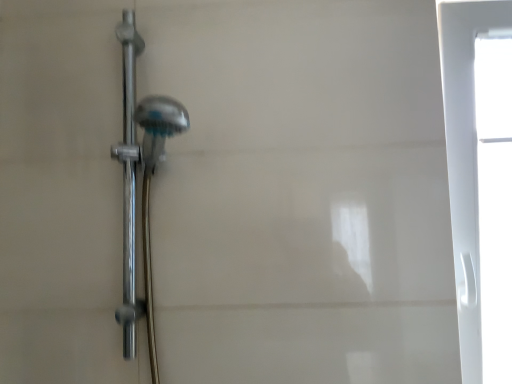
Where is `polished chrome shower head at left`? The height and width of the screenshot is (384, 512). polished chrome shower head at left is located at coordinates (129, 181).

What is the approximate height of polished chrome shower head at left?

polished chrome shower head at left is 28.89 inches tall.

The image size is (512, 384). Describe the element at coordinates (129, 181) in the screenshot. I see `polished chrome shower head at left` at that location.

At what (x,y) coordinates should I click in order to perform the action: click on polished chrome shower head at left. Please return your answer as a coordinate pair (x, y). Looking at the image, I should click on (129, 181).